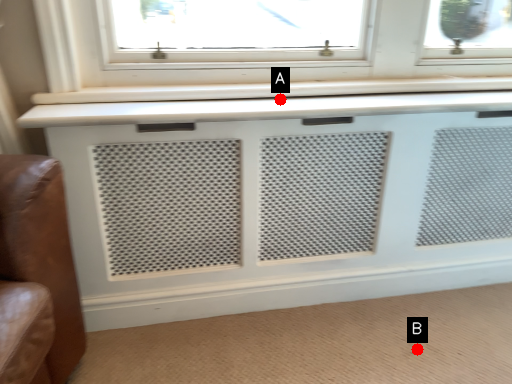
Question: Two points are circled on the image, labeled by A and B beside each circle. Among these points, which one is farthest from the camera?

Choices:
 (A) A is further
 (B) B is further

Answer: (B)